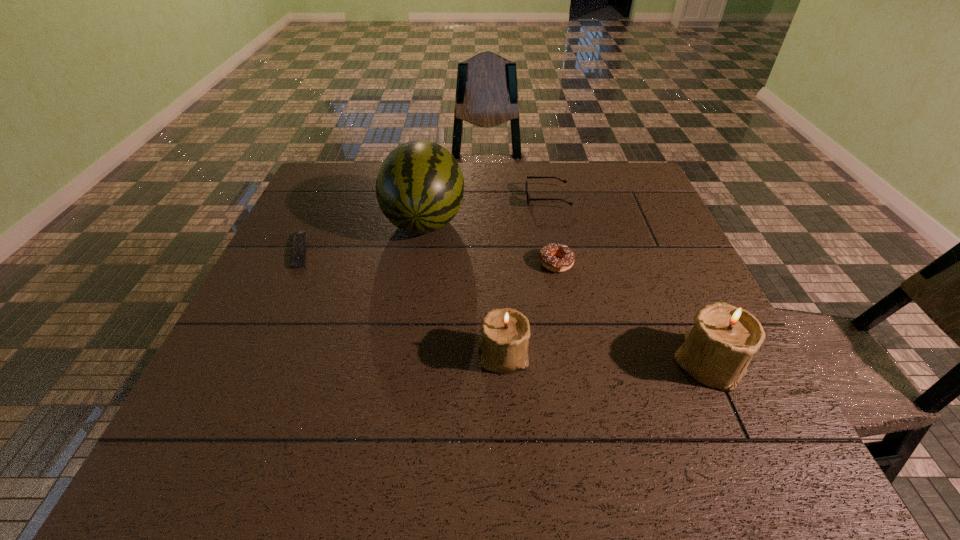
In the current image, all candle_holders are evenly spaced. To maintain this equal spacing, where should an additional candle_holder be placed on the left? Please point out a free spot. Please provide its 2D coordinates. Your answer should be formatted as a tuple, i.e. [(x, y)], where the tuple contains the x and y coordinates of a point satisfying the conditions above.

[(304, 348)]